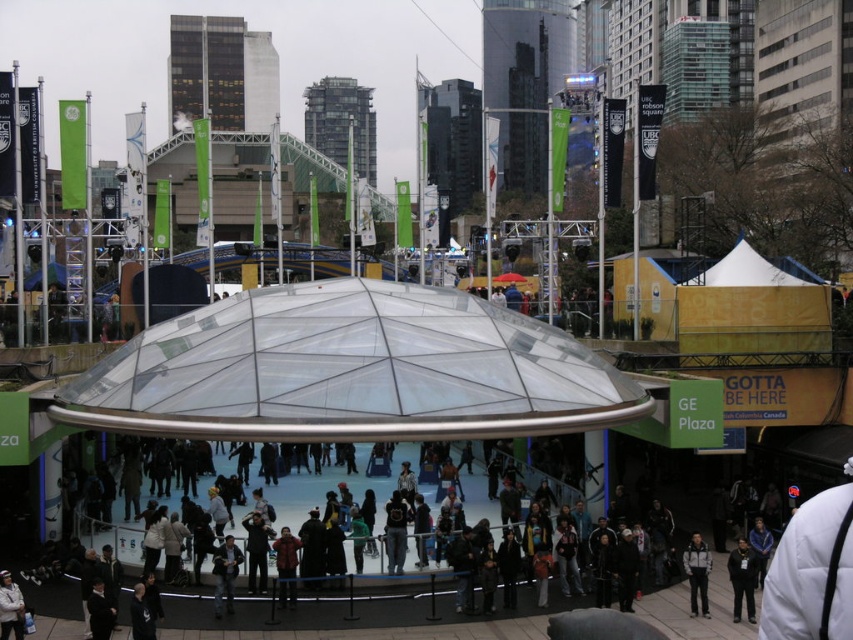
You are planning to take a photo of the transparent glass dome at center and the white fleece jacket at lower right from a distance. Which object will appear wider in the photo?

The transparent glass dome at center will appear wider in the photo because its width surpasses that of the white fleece jacket at lower right.

You are planning to install a new lighting system for the transparent glass dome at center and the white fleece jacket at lower right. Since you need to ensure the lights can reach the top of both objects, which object requires taller lighting equipment?

The transparent glass dome at center requires taller lighting equipment because it has a greater height compared to the white fleece jacket at lower right.